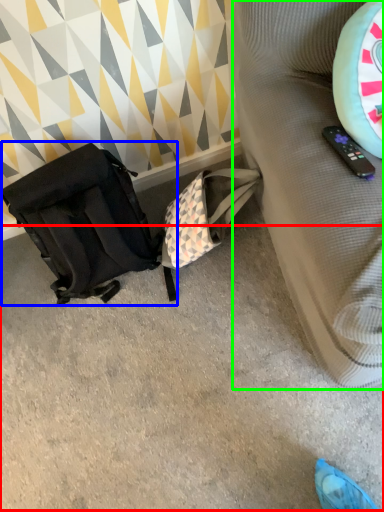
Question: Based on their relative distances, which object is nearer to concrete (highlighted by a red box)? Choose from luggage and bags (highlighted by a blue box) and furniture (highlighted by a green box).

Choices:
 (A) luggage and bags
 (B) furniture

Answer: (A)